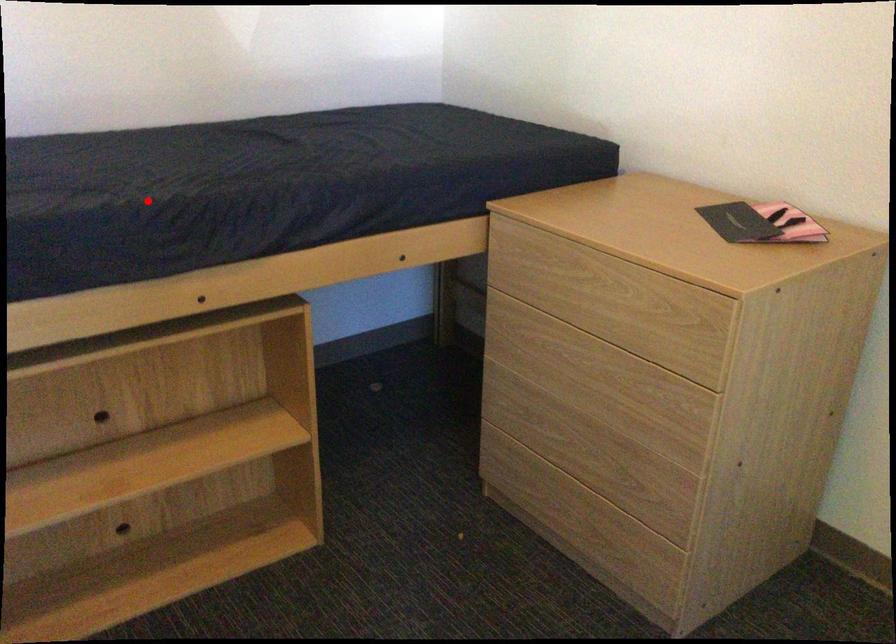
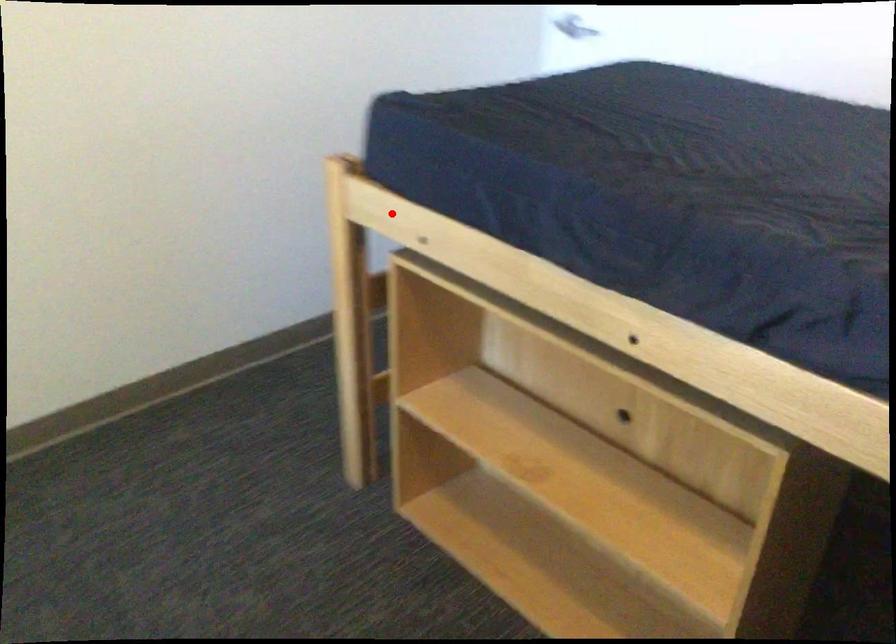
I am providing you with two images of the same scene from different viewpoints. A red point is marked on the first image and another point is marked on the second image. Is the marked point in image1 the same physical position as the marked point in image2?

No